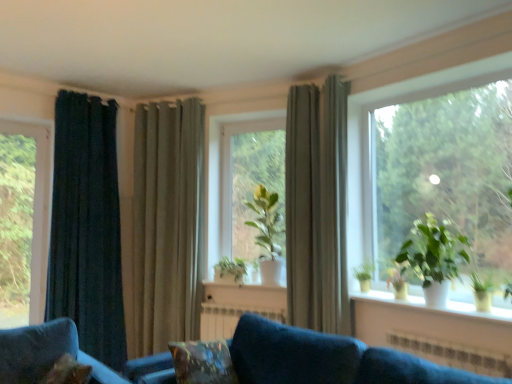
Question: Is velvety brown pillow at lower center oriented away from velvet blue couch at lower center?

Choices:
 (A) no
 (B) yes

Answer: (B)

Question: Does velvety brown pillow at lower center come behind velvet blue couch at lower center?

Choices:
 (A) no
 (B) yes

Answer: (B)

Question: Is velvety brown pillow at lower center taller than velvet blue couch at lower center?

Choices:
 (A) yes
 (B) no

Answer: (B)

Question: Is there a large distance between velvety brown pillow at lower center and velvet blue couch at lower center?

Choices:
 (A) no
 (B) yes

Answer: (A)

Question: Can you confirm if velvety brown pillow at lower center is positioned to the right of velvet blue couch at lower center?

Choices:
 (A) yes
 (B) no

Answer: (B)

Question: Looking at their shapes, would you say green fabric curtain at center, which is counted as the 2th curtain, starting from the left, is wider or thinner than white metallic radiator at center?

Choices:
 (A) thin
 (B) wide

Answer: (B)

Question: From the image's perspective, is green fabric curtain at center, the 2th curtain viewed from the right, positioned above or below white metallic radiator at center?

Choices:
 (A) below
 (B) above

Answer: (B)

Question: Is green fabric curtain at center, the 2th curtain viewed from the right, situated inside white metallic radiator at center or outside?

Choices:
 (A) outside
 (B) inside

Answer: (A)

Question: Visually, is green fabric curtain at center, which is counted as the 2th curtain, starting from the left, positioned to the left or to the right of white metallic radiator at center?

Choices:
 (A) left
 (B) right

Answer: (A)

Question: Relative to green fabric curtain at center, the 2th curtain viewed from the right, is green matte plant at center, which appears as the 2th houseplant when viewed from the left, in front or behind?

Choices:
 (A) behind
 (B) front

Answer: (B)

Question: Does point (271, 203) appear closer or farther from the camera than point (172, 117)?

Choices:
 (A) farther
 (B) closer

Answer: (B)

Question: Do you think green matte plant at center, which is counted as the 2th houseplant, starting from the back, is within green fabric curtain at center, the 2th curtain viewed from the right, or outside of it?

Choices:
 (A) outside
 (B) inside

Answer: (A)

Question: Looking at the image, does green matte plant at center, which is counted as the 2th houseplant, starting from the back, seem bigger or smaller compared to green fabric curtain at center, the 2th curtain viewed from the right?

Choices:
 (A) small
 (B) big

Answer: (A)

Question: Is transparent glass window at left, arranged as the 1th window when viewed from the left, inside or outside of green matte plant at center, acting as the 1th houseplant starting from the back?

Choices:
 (A) outside
 (B) inside

Answer: (A)

Question: Is transparent glass window at left, the 2th window viewed from the front, taller or shorter than green matte plant at center, positioned as the third houseplant in right-to-left order?

Choices:
 (A) short
 (B) tall

Answer: (B)